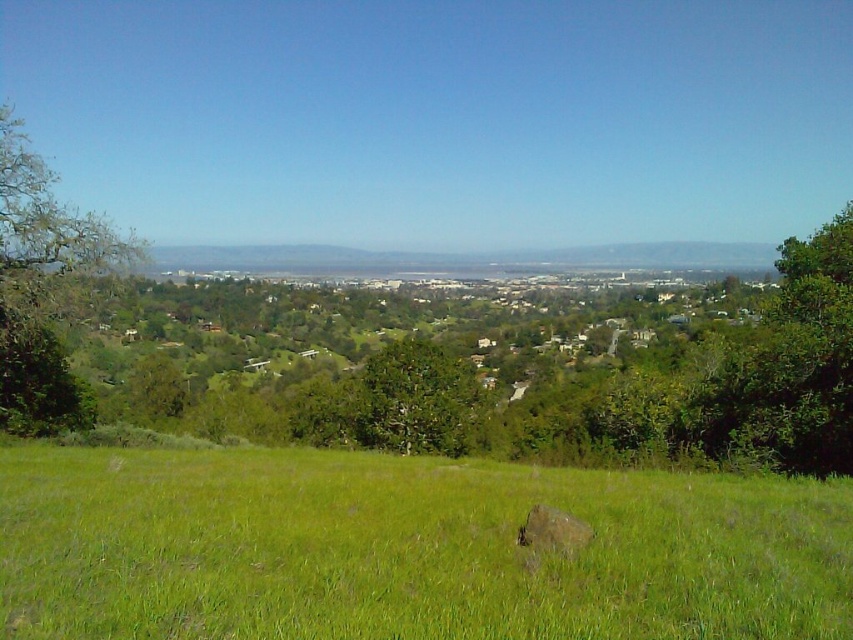
You are standing at the center of the image and want to locate the green leafy tree at left. Which direction should you face to see it?

You should face to the left to see the green leafy tree at left, as it is located at point (41,288) which is to the left side of the image.

You are a hiker standing on the grassy terrain in the foreground of the landscape. You want to reach the urban area in the background. To avoid obstacles, you need to know the position of the green leafy tree at center and the brown rough rock at center. Which object is closer to you?

The green leafy tree at center is positioned under the brown rough rock at center, so the brown rough rock at center is closer to you.